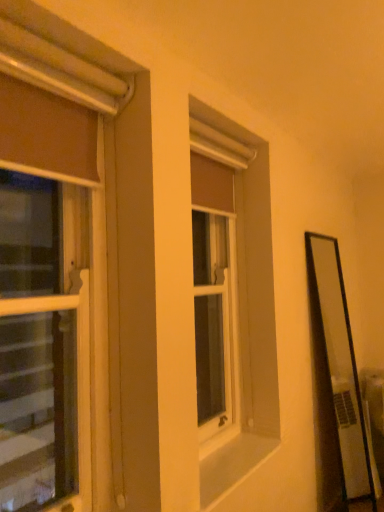
Identify the location of free location above white smooth window sill at center (from a real-world perspective). The height and width of the screenshot is (512, 384). (226, 451).